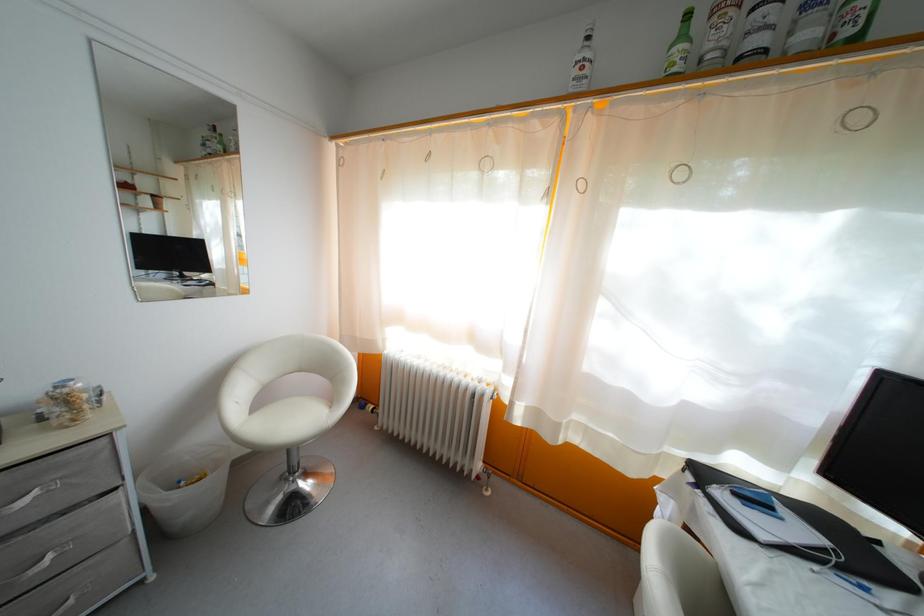
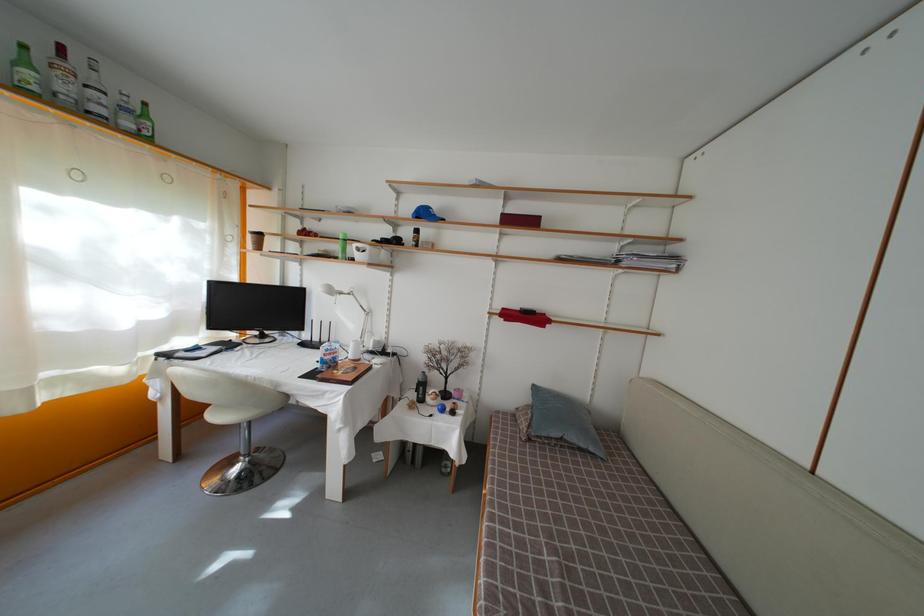
Locate, in the second image, the point that corresponds to the point at 688,43 in the first image.

(31, 69)